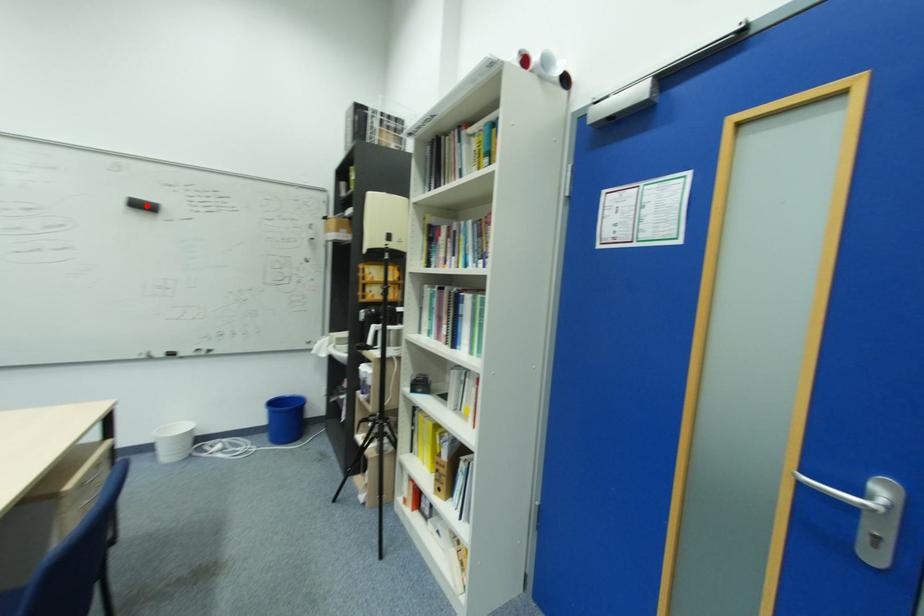
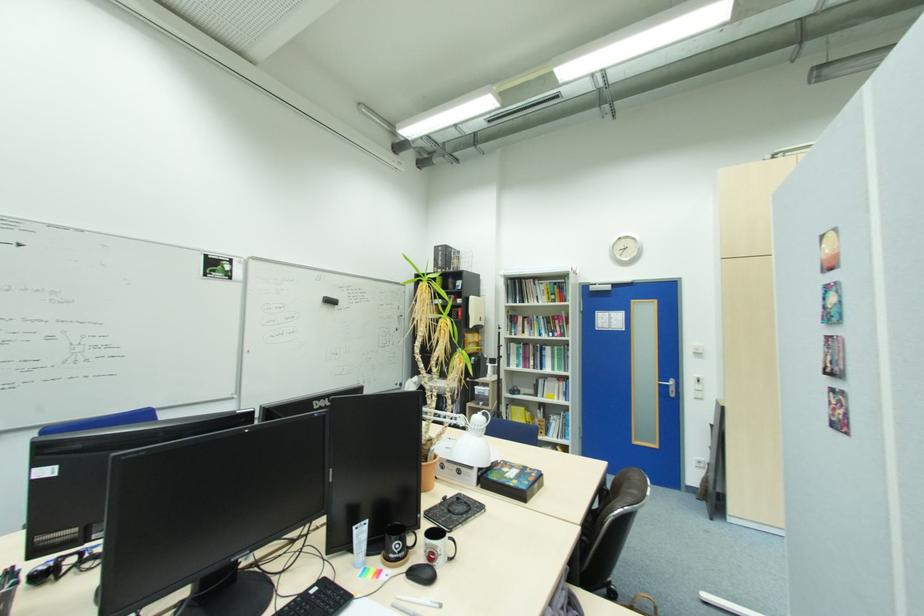
Find the pixel in the second image that matches the highlighted location in the first image.

(334, 302)